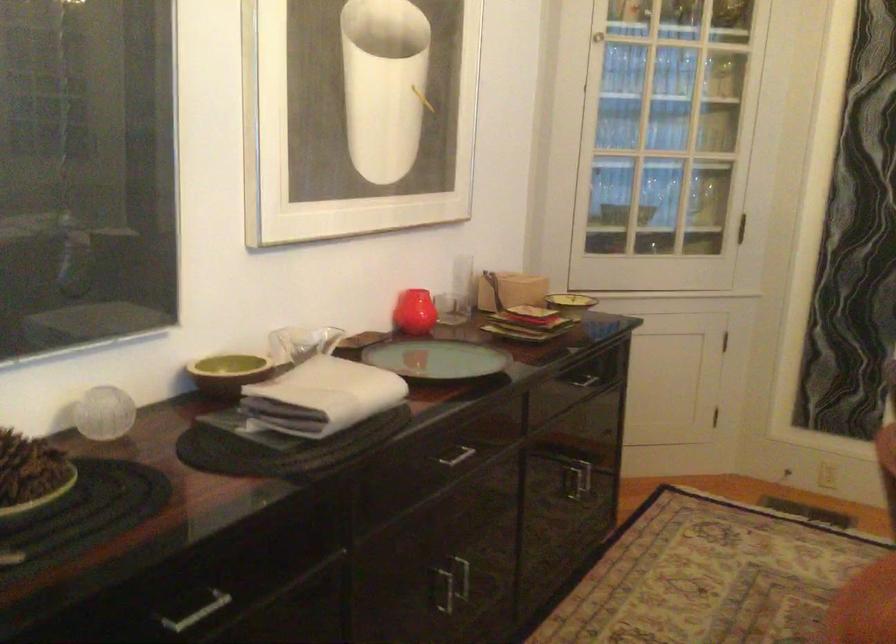
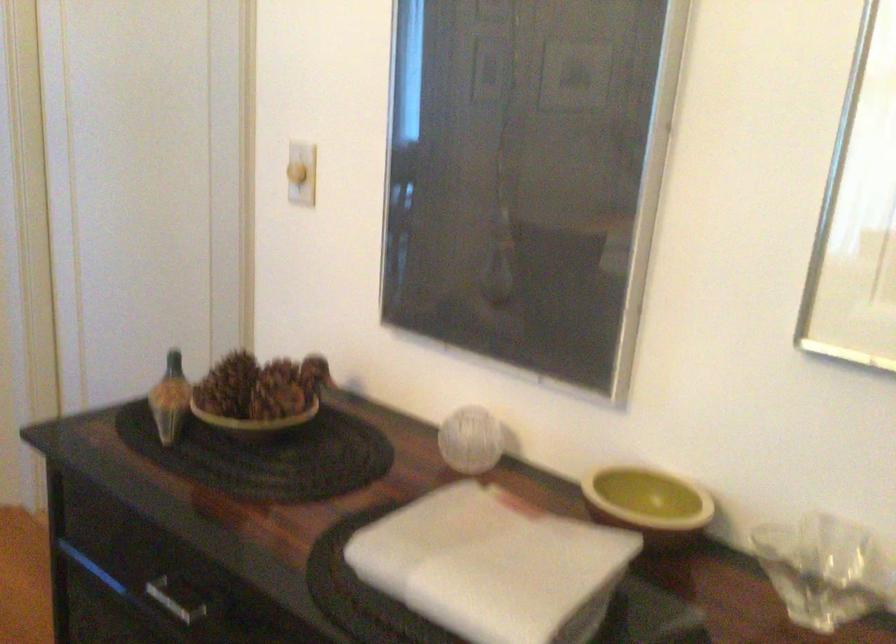
The point at (x=145, y=413) is marked in the first image. Where is the corresponding point in the second image?

(470, 440)